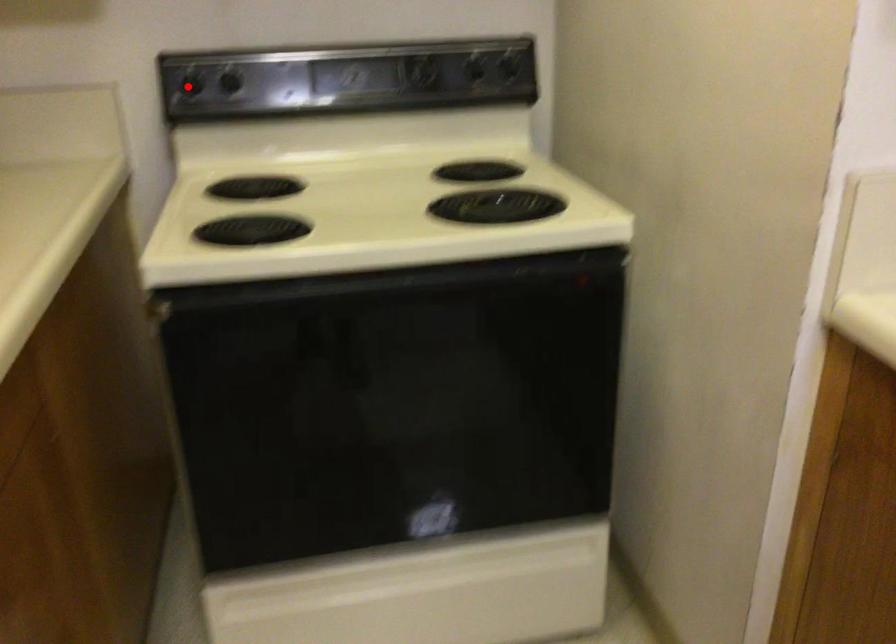
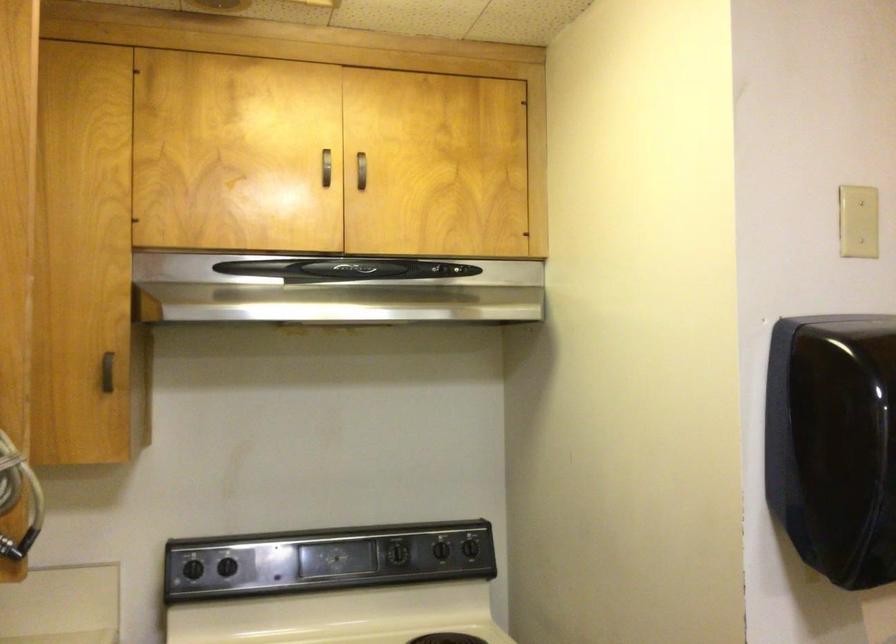
Question: I am providing you with two images of the same scene from different viewpoints. Image1 has a red point marked. In image2, the corresponding 3D location appears at what relative position? Reply with the corresponding letter.

Choices:
 (A) Closer
 (B) Farther

Answer: (B)